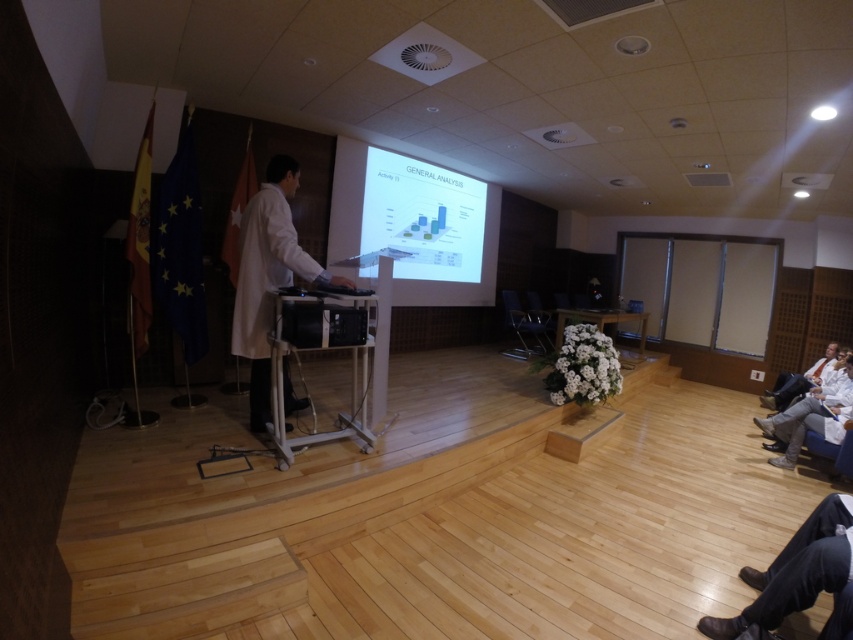
Question: Can you confirm if brown leather shoes at lower right is positioned above white plastic podium at center?

Choices:
 (A) yes
 (B) no

Answer: (B)

Question: Which object appears farthest from the camera in this image?

Choices:
 (A) white glossy projector screen at center
 (B) white plastic podium at center
 (C) black plastic chair at center
 (D) brown leather shoes at lower right

Answer: (C)

Question: Based on their relative distances, which object is nearer to the brown leather shoes at lower right?

Choices:
 (A) white plastic podium at center
 (B) black plastic chair at center
 (C) white matte coat at center
 (D) white glossy projector screen at center

Answer: (A)

Question: Does white matte coat at center come in front of black plastic chair at center?

Choices:
 (A) no
 (B) yes

Answer: (B)

Question: Among these objects, which one is nearest to the camera?

Choices:
 (A) white glossy projector screen at center
 (B) brown leather shoes at lower right
 (C) white matte coat at center
 (D) white plastic podium at center

Answer: (B)

Question: Can you confirm if white plastic podium at center is wider than black plastic chair at center?

Choices:
 (A) yes
 (B) no

Answer: (B)